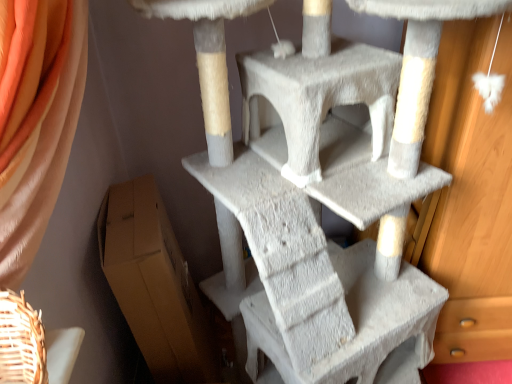
Question: Considering the positions of brown cardboard box at lower left and white textured cat tree at center in the image, is brown cardboard box at lower left taller or shorter than white textured cat tree at center?

Choices:
 (A) short
 (B) tall

Answer: (A)

Question: In terms of size, does brown cardboard box at lower left appear bigger or smaller than white textured cat tree at center?

Choices:
 (A) small
 (B) big

Answer: (A)

Question: From the image's perspective, is brown cardboard box at lower left above or below white textured cat tree at center?

Choices:
 (A) above
 (B) below

Answer: (B)

Question: Considering the positions of white textured cat tree at center and brown cardboard box at lower left in the image, is white textured cat tree at center bigger or smaller than brown cardboard box at lower left?

Choices:
 (A) small
 (B) big

Answer: (B)

Question: From the image's perspective, is white textured cat tree at center above or below brown cardboard box at lower left?

Choices:
 (A) below
 (B) above

Answer: (B)

Question: In the image, is white textured cat tree at center positioned in front of or behind brown cardboard box at lower left?

Choices:
 (A) front
 (B) behind

Answer: (A)

Question: Visually, is white textured cat tree at center positioned to the left or to the right of brown cardboard box at lower left?

Choices:
 (A) right
 (B) left

Answer: (A)